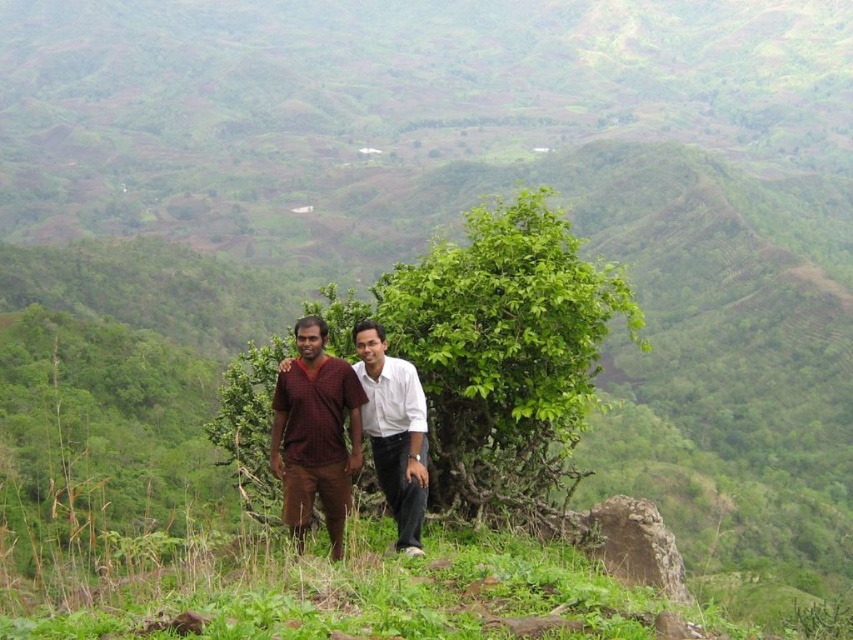
Between point (416, 500) and point (386, 365), which one is positioned in front?

Point (416, 500)

How far apart are maroon fabric shirt at center and white smooth shirt at center?

maroon fabric shirt at center and white smooth shirt at center are 2.85 centimeters apart.

Does point (398, 490) lie in front of point (389, 483)?

Yes.

Where is `maroon fabric shirt at center`? maroon fabric shirt at center is located at coordinates (393, 429).